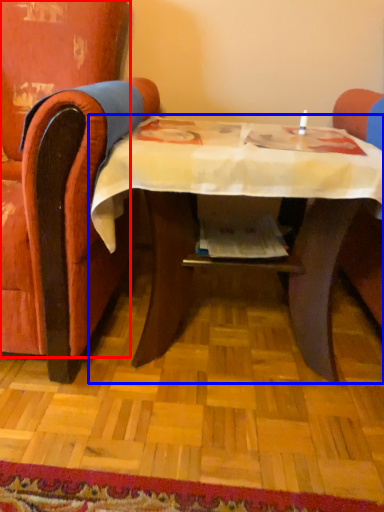
Question: Which object is closer to the camera taking this photo, chair (highlighted by a red box) or table (highlighted by a blue box)?

Choices:
 (A) chair
 (B) table

Answer: (A)